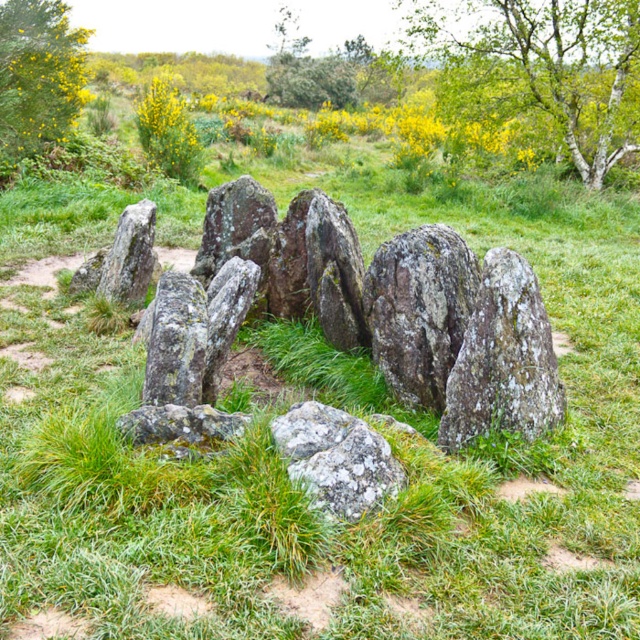
Question: Does gray rough rock at center have a smaller size compared to yellow-green textured bush at upper left?

Choices:
 (A) no
 (B) yes

Answer: (B)

Question: Among these points, which one is nearest to the camera?

Choices:
 (A) (349, 474)
 (B) (477, 24)
 (C) (60, 58)
 (D) (129, 280)

Answer: (A)

Question: Which object is the closest to the speckled gray rock at center?

Choices:
 (A) rough gray rock at left
 (B) green leafy tree at upper center
 (C) green leafy tree at upper left

Answer: (A)

Question: Does gray rough rock at center have a smaller size compared to rough gray rock at left?

Choices:
 (A) no
 (B) yes

Answer: (B)

Question: Is green leafy tree at upper center in front of green leafy tree at upper left?

Choices:
 (A) no
 (B) yes

Answer: (A)

Question: Which point is farther to the camera?

Choices:
 (A) yellow-green textured bush at upper left
 (B) gray rough rock at center

Answer: (A)